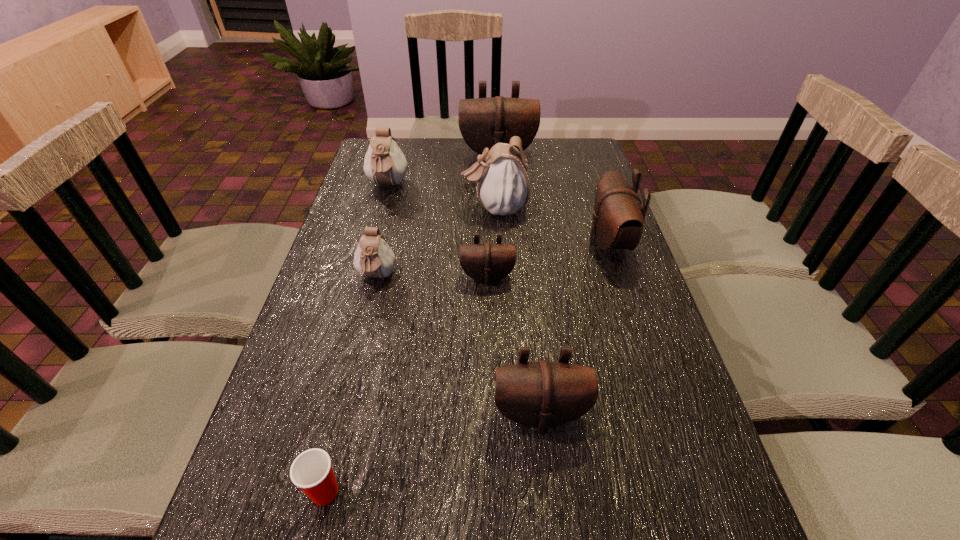
What are the coordinates of `vacant position located 0.150m with the flap open on the second nearest object` in the screenshot? It's located at (552, 526).

At what (x,y) coordinates should I click in order to perform the action: click on blank space located 0.130m on the front-facing side of the nearest white pouch. Please return your answer as a coordinate pair (x, y). Looking at the image, I should click on (363, 336).

The height and width of the screenshot is (540, 960). What are the coordinates of `vacant space located 0.320m with the flap open on the smallest brown pouch` in the screenshot? It's located at (490, 402).

This screenshot has width=960, height=540. Identify the location of free spot located 0.050m on the back of the nearest object. (336, 446).

What are the coordinates of `object at the far edge` in the screenshot? It's located at (483, 122).

Find the location of a particular element. Dixie cup that is at the left edge is located at coordinates (311, 471).

You are a GUI agent. You are given a task and a screenshot of the screen. Output one action in this format:
    pyautogui.click(x=<x>, y=<y>)
    Task: Click on the object at the right edge
    The image size is (960, 540).
    Given the screenshot: What is the action you would take?
    pyautogui.click(x=618, y=218)

In the image, there is a desktop. Where is `vacant area at the far edge`? The height and width of the screenshot is (540, 960). vacant area at the far edge is located at coordinates (443, 157).

The width and height of the screenshot is (960, 540). What are the coordinates of `free spot at the left edge of the desktop` in the screenshot? It's located at (344, 352).

This screenshot has height=540, width=960. I want to click on vacant space at the right edge of the desktop, so click(x=630, y=352).